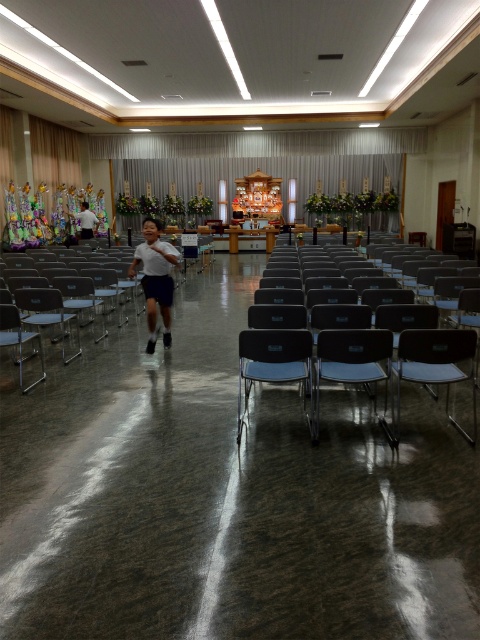
You are standing in the room and want to know how far the point at coordinates (407,365) is from you. Can you determine the distance?

The distance of point (407,365) from viewer is 13.82 feet.